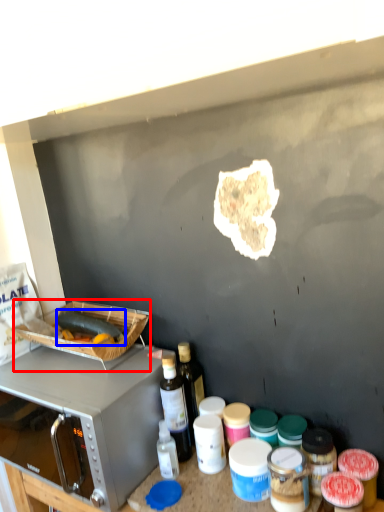
Question: Which point is closer to the camera, appliance (highlighted by a red box) or food (highlighted by a blue box)?

Choices:
 (A) appliance
 (B) food

Answer: (A)